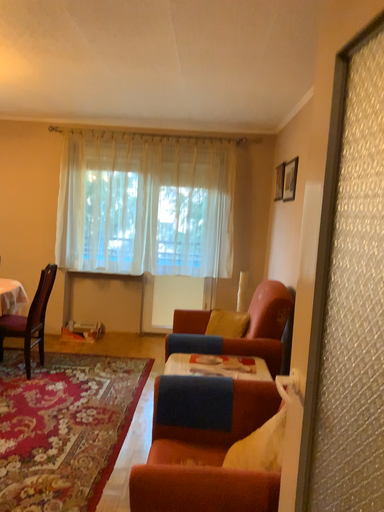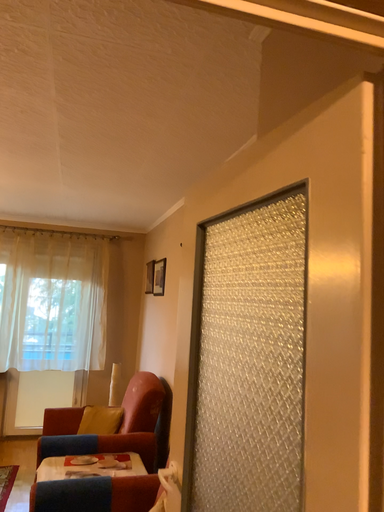
Question: Which way did the camera rotate in the video?

Choices:
 (A) rotated right
 (B) rotated left

Answer: (A)